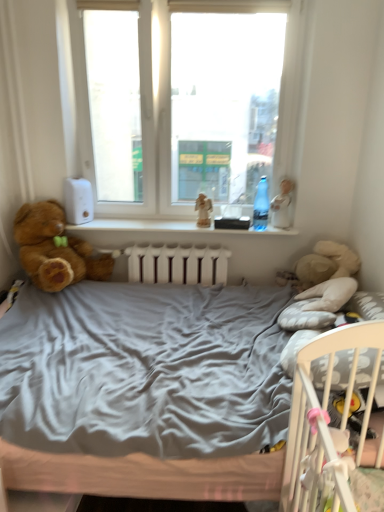
Question: Is white plastic window sill at center outside of wooden angel at center?

Choices:
 (A) no
 (B) yes

Answer: (B)

Question: Is white plastic window sill at center thinner than wooden angel at center?

Choices:
 (A) no
 (B) yes

Answer: (A)

Question: Is wooden angel at center located within white plastic window sill at center?

Choices:
 (A) no
 (B) yes

Answer: (A)

Question: Is there a large distance between white plastic window sill at center and wooden angel at center?

Choices:
 (A) yes
 (B) no

Answer: (B)

Question: Is the position of white plastic window sill at center more distant than that of wooden angel at center?

Choices:
 (A) yes
 (B) no

Answer: (B)

Question: Is white plastic window sill at center closer to camera compared to wooden angel at center?

Choices:
 (A) yes
 (B) no

Answer: (A)

Question: Does white plastic window sill at center turn towards white porcelain doll at upper right?

Choices:
 (A) yes
 (B) no

Answer: (B)

Question: Is white plastic window sill at center positioned with its back to white porcelain doll at upper right?

Choices:
 (A) no
 (B) yes

Answer: (A)

Question: Is white plastic window sill at center placed right next to white porcelain doll at upper right?

Choices:
 (A) no
 (B) yes

Answer: (A)

Question: From the image's perspective, is white plastic window sill at center under white porcelain doll at upper right?

Choices:
 (A) no
 (B) yes

Answer: (B)

Question: Can you confirm if white plastic window sill at center is shorter than white porcelain doll at upper right?

Choices:
 (A) yes
 (B) no

Answer: (A)

Question: From the image's perspective, would you say white plastic window sill at center is positioned over white porcelain doll at upper right?

Choices:
 (A) no
 (B) yes

Answer: (A)

Question: Are brown plush teddy bear at left and white plastic window sill at center located far from each other?

Choices:
 (A) yes
 (B) no

Answer: (B)